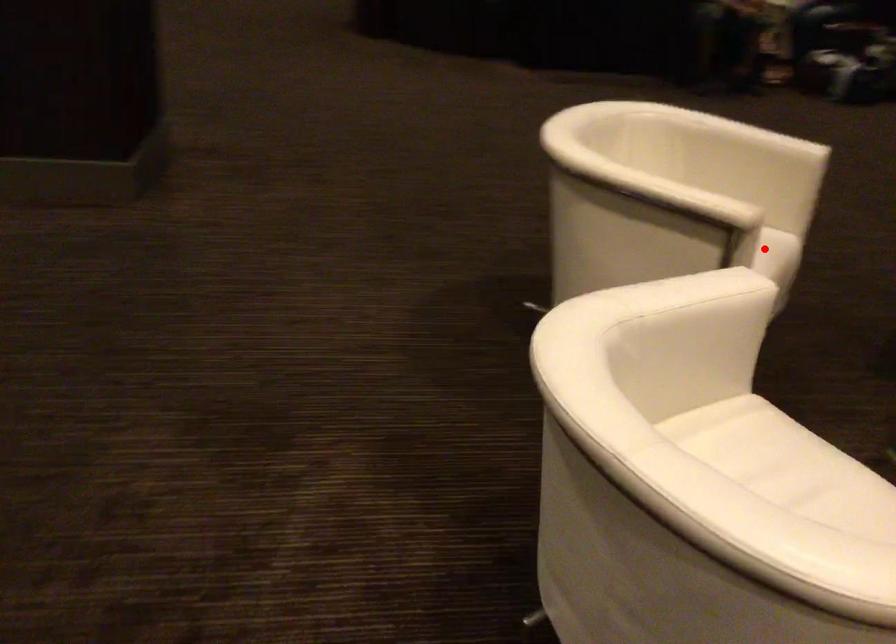
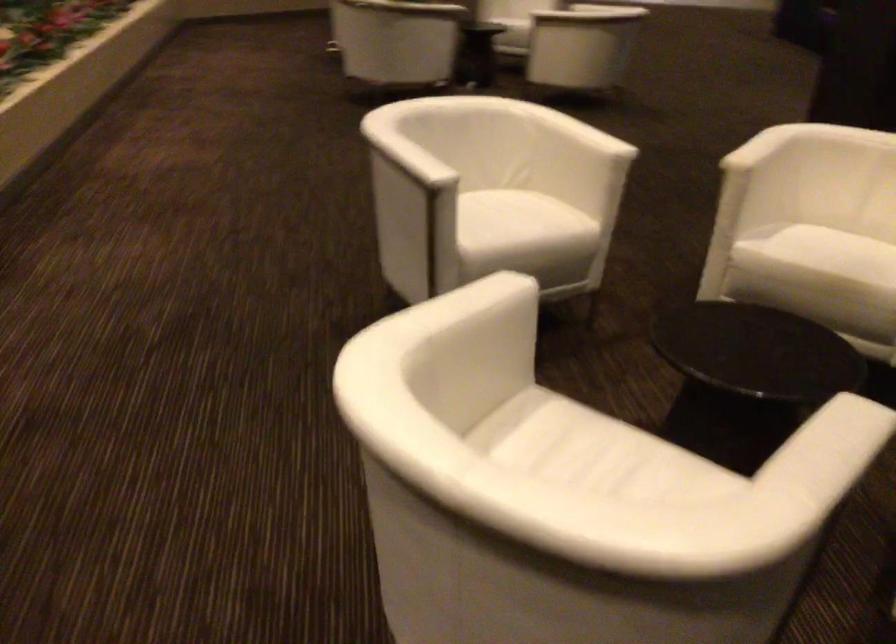
Find the pixel in the second image that matches the highlighted location in the first image.

(836, 252)